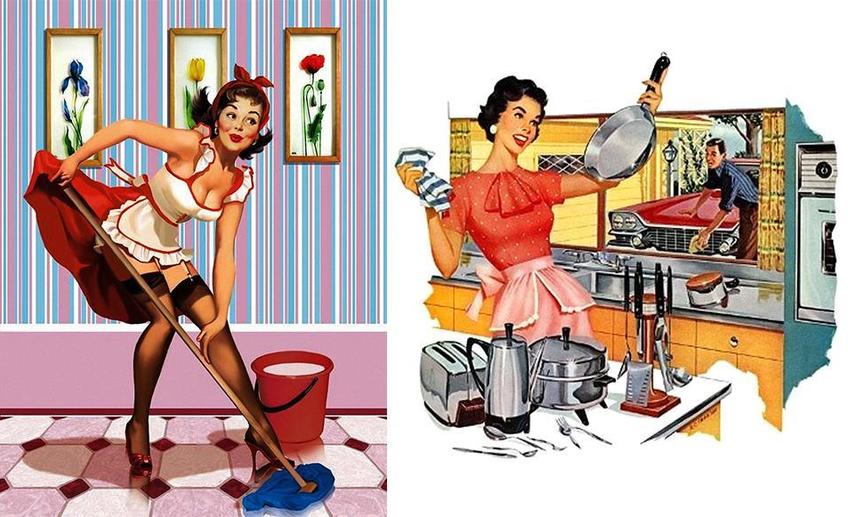
Find the location of a particular element. The width and height of the screenshot is (848, 517). mop is located at coordinates (281, 496).